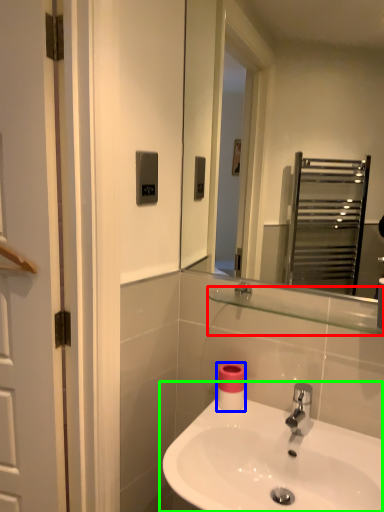
Question: Which object is positioned closest to balustrade (highlighted by a red box)? Select from toilet paper (highlighted by a blue box) and sink (highlighted by a green box).

Choices:
 (A) toilet paper
 (B) sink

Answer: (A)